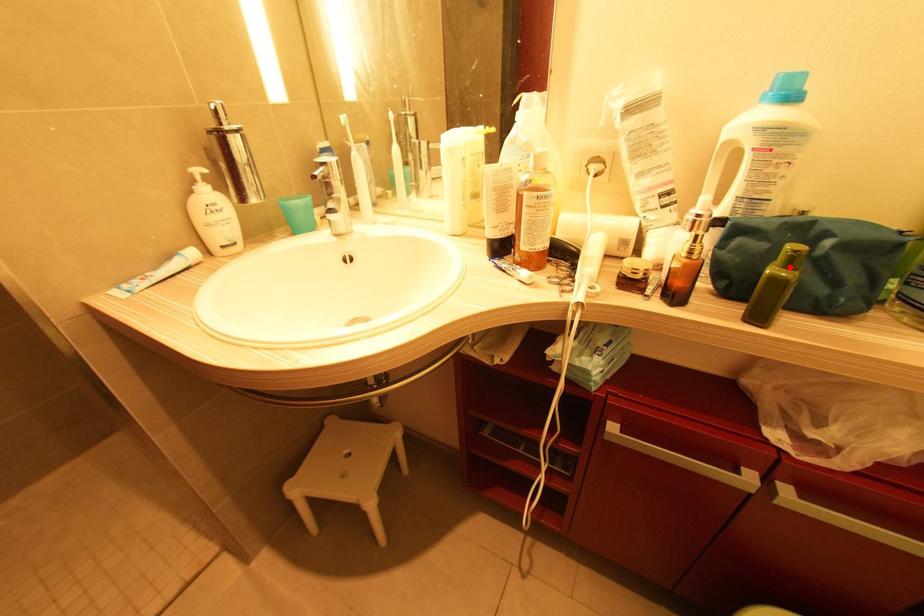
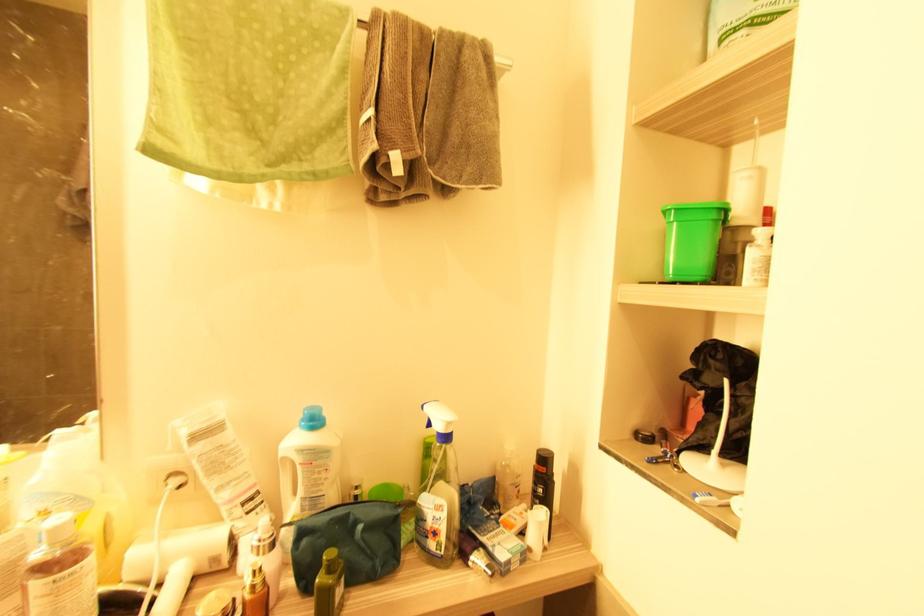
Question: I am providing you with two images of the same scene from different viewpoints. A red point is marked on the first image. Is the red point's position out of view in image 2?

Choices:
 (A) Yes
 (B) No

Answer: (B)